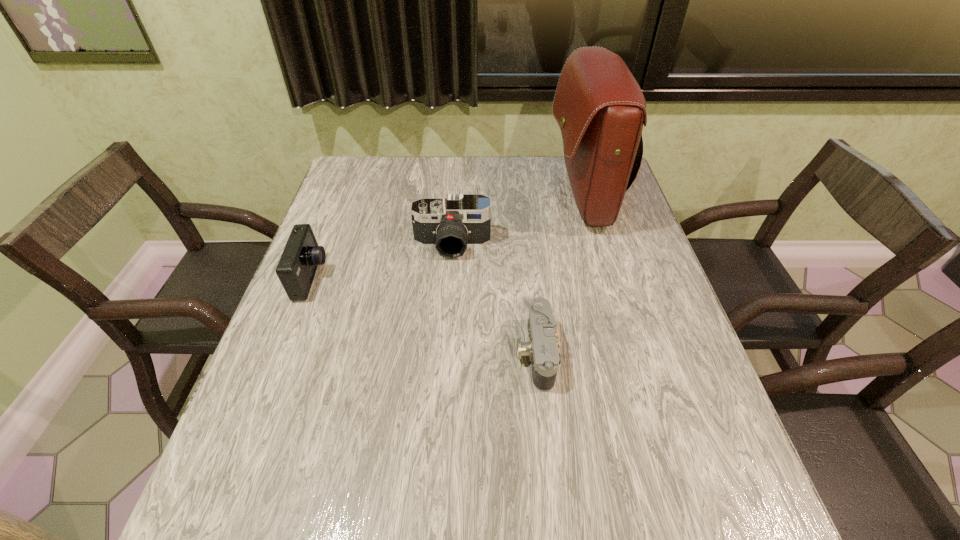
Identify the location of free point between the nearest camera and the second camera from left to right. (493, 299).

Where is `vacant area that lies between the third object from right to left and the satchel`? vacant area that lies between the third object from right to left and the satchel is located at coordinates (517, 221).

I want to click on object identified as the third closest to the shortest object, so [x=296, y=269].

I want to click on the closest object to the second camera from right to left, so click(599, 106).

Choose which camera is the third nearest neighbor to the tallest object. Please provide its 2D coordinates. Your answer should be formatted as a tuple, i.e. [(x, y)], where the tuple contains the x and y coordinates of a point satisfying the conditions above.

[(296, 269)]

Find the location of `camera that is the second closest to the second object from right to left`. camera that is the second closest to the second object from right to left is located at coordinates (296, 269).

This screenshot has width=960, height=540. Identify the location of free location that satisfies the following two spatial constraints: 1. on the front-facing side of the second camera from right to left; 2. on the front-facing side of the leftmost camera. (450, 278).

Find the location of a particular element. This screenshot has width=960, height=540. free space that satisfies the following two spatial constraints: 1. on the front-facing side of the third object from right to left; 2. on the front-facing side of the leftmost camera is located at coordinates (450, 278).

You are a GUI agent. You are given a task and a screenshot of the screen. Output one action in this format:
    pyautogui.click(x=<x>, y=<y>)
    Task: Click on the vacant space that satisfies the following two spatial constraints: 1. on the front-facing side of the second camera from right to left; 2. on the front-facing side of the leftmost camera
    This screenshot has width=960, height=540.
    Given the screenshot: What is the action you would take?
    pyautogui.click(x=450, y=278)